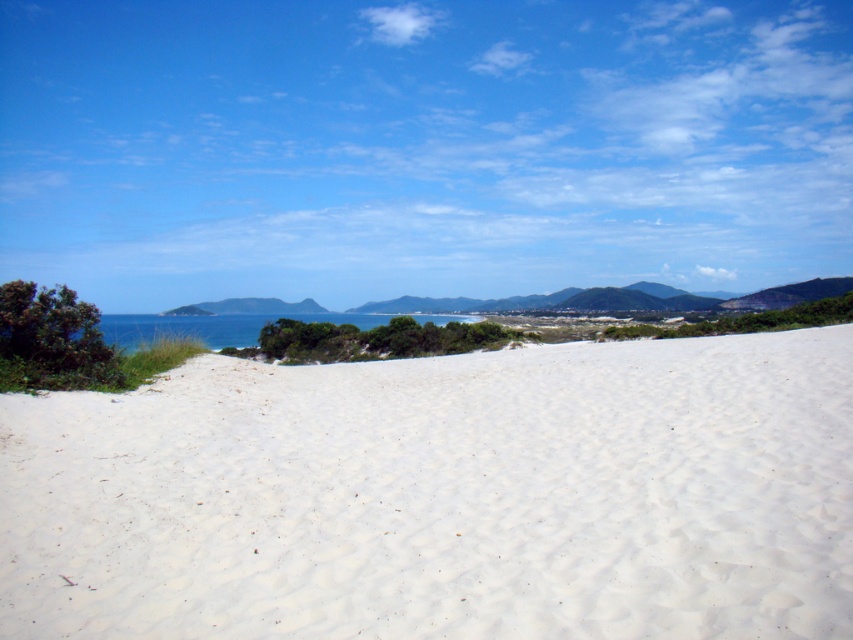
Question: Can you confirm if white sandy beach at center is bigger than blue water at center?

Choices:
 (A) no
 (B) yes

Answer: (A)

Question: Is white sandy beach at center above blue water at center?

Choices:
 (A) yes
 (B) no

Answer: (B)

Question: Considering the relative positions of white sandy beach at center and blue water at center in the image provided, where is white sandy beach at center located with respect to blue water at center?

Choices:
 (A) above
 (B) below

Answer: (B)